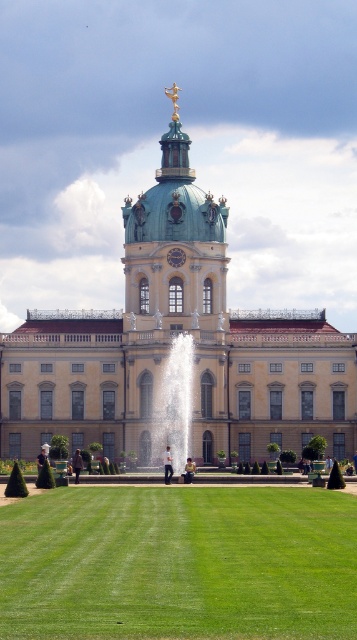
Question: Based on their relative distances, which object is nearer to the white marble fountain at center?

Choices:
 (A) green grass at center
 (B) beige stone palace at center

Answer: (B)

Question: Based on their relative distances, which object is farther from the white marble fountain at center?

Choices:
 (A) green grass at center
 (B) beige stone palace at center

Answer: (A)

Question: Is beige stone palace at center in front of green grass at center?

Choices:
 (A) yes
 (B) no

Answer: (B)

Question: Among these points, which one is farthest from the camera?

Choices:
 (A) (255, 566)
 (B) (83, 390)
 (C) (164, 369)

Answer: (B)

Question: Where is green grass at center located in relation to white marble fountain at center in the image?

Choices:
 (A) below
 (B) above

Answer: (A)

Question: Is beige stone palace at center below green grass at center?

Choices:
 (A) yes
 (B) no

Answer: (B)